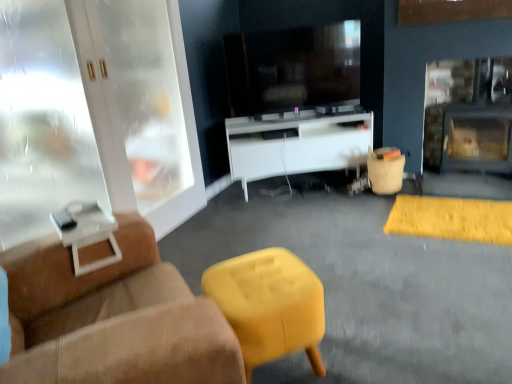
Question: From a real-world perspective, is bamboo basket at right, which is the 1th bar stool in right-to-left order, physically above suede ottoman at lower center?

Choices:
 (A) no
 (B) yes

Answer: (B)

Question: Is bamboo basket at right, marked as the 2th bar stool in a left-to-right arrangement, facing away from suede ottoman at lower center?

Choices:
 (A) no
 (B) yes

Answer: (A)

Question: Is bamboo basket at right, the second bar stool when ordered from bottom to top, to the right of suede ottoman at lower center from the viewer's perspective?

Choices:
 (A) no
 (B) yes

Answer: (B)

Question: Considering the relative sizes of bamboo basket at right, the 1th bar stool positioned from the top, and suede ottoman at lower center in the image provided, is bamboo basket at right, the 1th bar stool positioned from the top, taller than suede ottoman at lower center?

Choices:
 (A) yes
 (B) no

Answer: (A)

Question: Considering the relative sizes of bamboo basket at right, marked as the 2th bar stool in a left-to-right arrangement, and suede ottoman at lower center in the image provided, is bamboo basket at right, marked as the 2th bar stool in a left-to-right arrangement, smaller than suede ottoman at lower center?

Choices:
 (A) yes
 (B) no

Answer: (A)

Question: Is suede ottoman at lower center taller or shorter than matte black fireplace at right?

Choices:
 (A) tall
 (B) short

Answer: (B)

Question: Is suede ottoman at lower center to the left or to the right of matte black fireplace at right in the image?

Choices:
 (A) left
 (B) right

Answer: (A)

Question: Looking at the image, does suede ottoman at lower center seem bigger or smaller compared to matte black fireplace at right?

Choices:
 (A) big
 (B) small

Answer: (A)

Question: From the image's perspective, relative to matte black fireplace at right, is suede ottoman at lower center above or below?

Choices:
 (A) above
 (B) below

Answer: (B)

Question: From a real-world perspective, is suede brown studio couch at left physically located above or below bamboo basket at right, the second bar stool when ordered from bottom to top?

Choices:
 (A) below
 (B) above

Answer: (B)

Question: From their relative heights in the image, would you say suede brown studio couch at left is taller or shorter than bamboo basket at right, the 1th bar stool positioned from the top?

Choices:
 (A) short
 (B) tall

Answer: (B)

Question: From the image's perspective, relative to bamboo basket at right, which is the first bar stool from back to front, is suede brown studio couch at left above or below?

Choices:
 (A) below
 (B) above

Answer: (A)

Question: Relative to bamboo basket at right, which appears as the second bar stool when viewed from the front, is suede brown studio couch at left in front or behind?

Choices:
 (A) front
 (B) behind

Answer: (A)

Question: Based on their sizes in the image, would you say suede brown studio couch at left is bigger or smaller than white glossy cabinet at center?

Choices:
 (A) small
 (B) big

Answer: (B)

Question: In the image, is suede brown studio couch at left positioned in front of or behind white glossy cabinet at center?

Choices:
 (A) behind
 (B) front

Answer: (B)